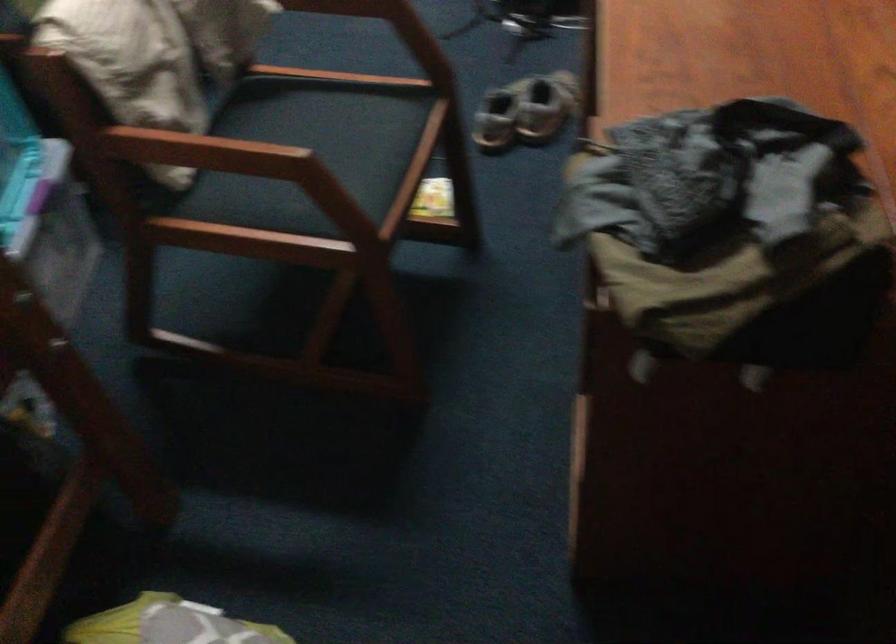
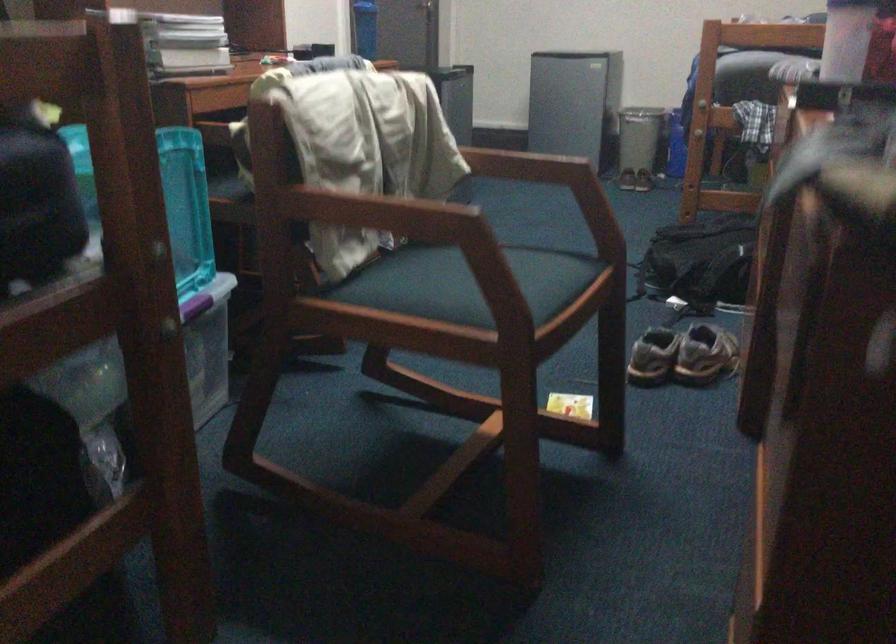
Question: The first image is from the beginning of the video and the second image is from the end. How did the camera likely rotate when shooting the video?

Choices:
 (A) Left
 (B) Right
 (C) Up
 (D) Down

Answer: (C)